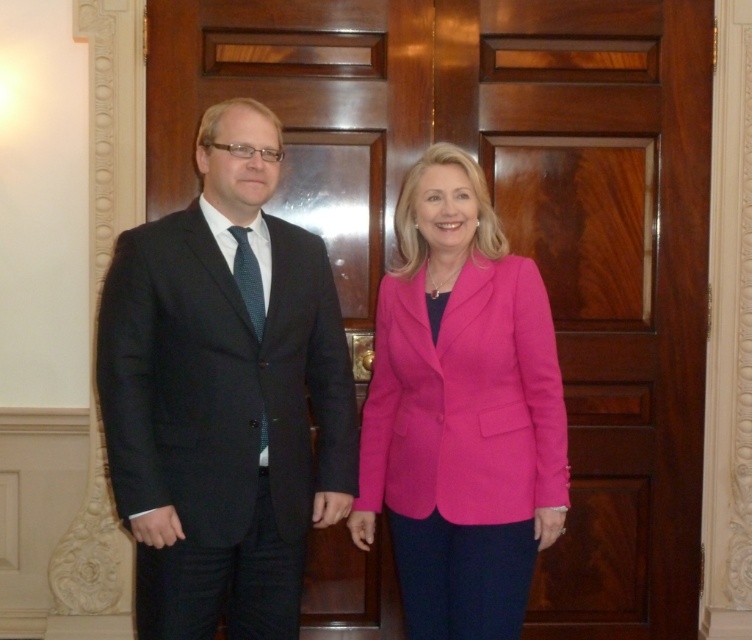
Is matte black suit at left below pink fabric jacket at center?

No, matte black suit at left is not below pink fabric jacket at center.

Is matte black suit at left taller than pink fabric jacket at center?

Yes, matte black suit at left is taller than pink fabric jacket at center.

This screenshot has height=640, width=752. Describe the element at coordinates (223, 394) in the screenshot. I see `matte black suit at left` at that location.

At what (x,y) coordinates should I click in order to perform the action: click on matte black suit at left. Please return your answer as a coordinate pair (x, y). Image resolution: width=752 pixels, height=640 pixels. Looking at the image, I should click on (223, 394).